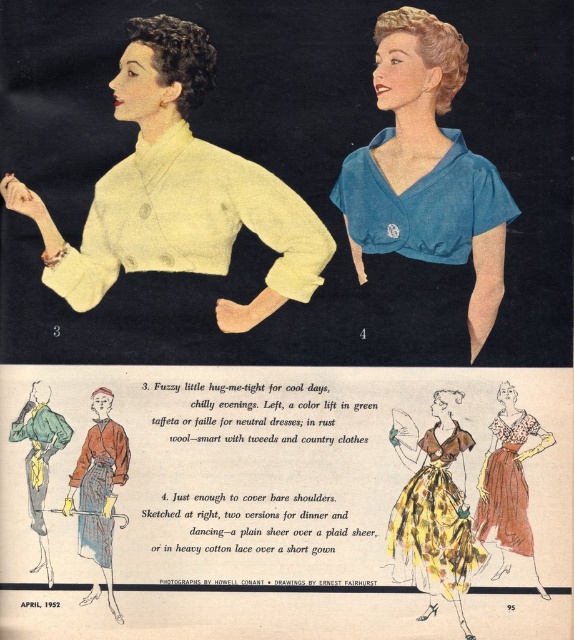
Does point (522, 472) lie in front of point (110, 524)?

No, (522, 472) is further to viewer.

Is floral print cotton dress at lower right above rust wool robe at lower left?

Yes, floral print cotton dress at lower right is above rust wool robe at lower left.

This screenshot has width=574, height=640. In order to click on floral print cotton dress at lower right in this screenshot , I will do `click(507, 481)`.

Between matte blue blouse at upper right and yellow floral fabric dress at lower right, which one has more height?

Standing taller between the two is matte blue blouse at upper right.

Is point (460, 193) farther from viewer compared to point (452, 438)?

Yes.

Locate an element on the screen. Image resolution: width=574 pixels, height=640 pixels. matte blue blouse at upper right is located at coordinates (425, 170).

Who is lower down, matte yellow sweater at center or floral print cotton dress at lower right?

floral print cotton dress at lower right is below.

Between point (135, 154) and point (513, 480), which one is positioned behind?

Positioned behind is point (513, 480).

Which is behind, point (44, 218) or point (510, 525)?

Positioned behind is point (510, 525).

Identify the location of matte yellow sweater at center. pyautogui.click(x=177, y=193).